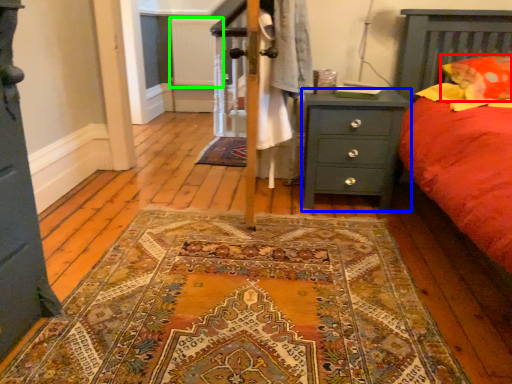
Question: Estimate the real-world distances between objects in this image. Which object is farther from pillow (highlighted by a red box), nightstand (highlighted by a blue box) or radiator (highlighted by a green box)?

Choices:
 (A) nightstand
 (B) radiator

Answer: (B)